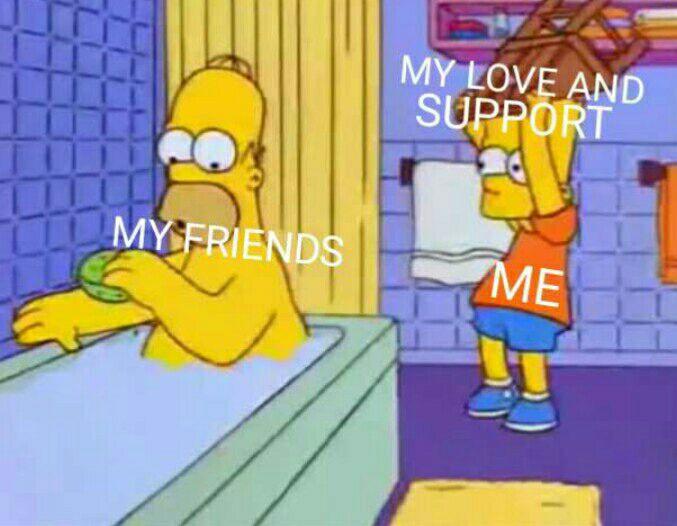
This screenshot has height=526, width=677. In order to click on chair in this screenshot , I will do `click(554, 47)`.